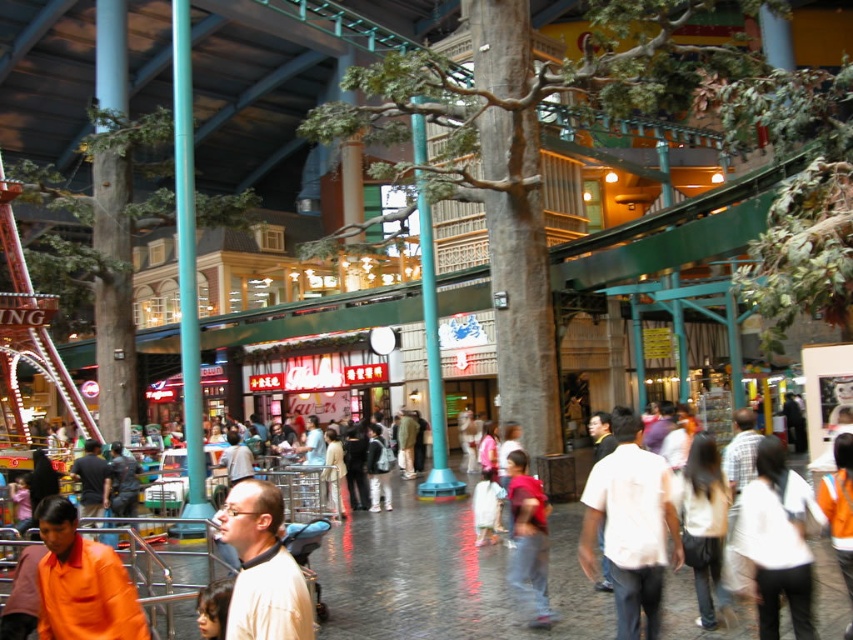
Measure the distance between point (654,477) and camera.

They are 37.90 meters apart.

Based on the photo, who is more distant from viewer, (604, 476) or (115, 564)?

The point (604, 476) is more distant.

Does point (635, 515) lie behind point (76, 566)?

Yes, point (635, 515) is farther from viewer.

Locate an element on the screen. The width and height of the screenshot is (853, 640). white cotton shirt at center is located at coordinates (630, 525).

Does point (670, 520) come behind point (515, 508)?

No, (670, 520) is closer to viewer.

Which of these two, white cotton shirt at center or red cotton shirt at center, stands shorter?

red cotton shirt at center is shorter.

At what (x,y) coordinates should I click in order to perform the action: click on white cotton shirt at center. Please return your answer as a coordinate pair (x, y). The height and width of the screenshot is (640, 853). Looking at the image, I should click on (630, 525).

Which is in front, point (128, 605) or point (287, 593)?

Point (287, 593) is more forward.

Which is more to the left, orange shirt at lower left or light beige shirt at center?

From the viewer's perspective, orange shirt at lower left appears more on the left side.

At what (x,y) coordinates should I click in order to perform the action: click on orange shirt at lower left. Please return your answer as a coordinate pair (x, y). Looking at the image, I should click on (82, 582).